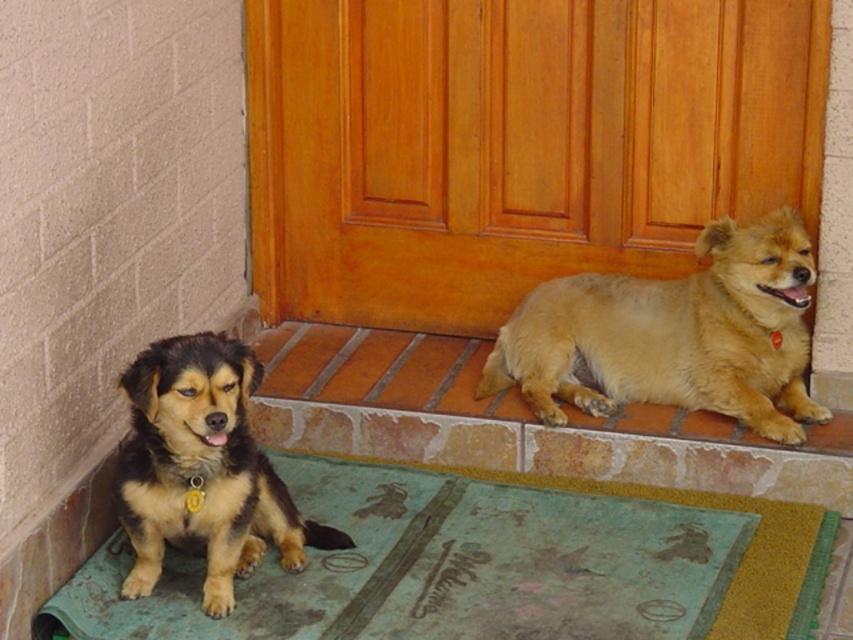
Is wooden at center smaller than green fabric doormat at lower left?

No, wooden at center is not smaller than green fabric doormat at lower left.

Describe the element at coordinates (514, 145) in the screenshot. I see `wooden at center` at that location.

This screenshot has width=853, height=640. In order to click on wooden at center in this screenshot , I will do `click(514, 145)`.

Who is more forward, (746,195) or (753,240)?

Point (753,240)

Measure the distance between point (479, 36) and camera.

Point (479, 36) and camera are 3.78 meters apart from each other.

The width and height of the screenshot is (853, 640). I want to click on wooden at center, so click(x=514, y=145).

Can you confirm if green fabric doormat at lower left is smaller than brown fur dog at left?

Actually, green fabric doormat at lower left might be larger than brown fur dog at left.

What do you see at coordinates (492, 564) in the screenshot?
I see `green fabric doormat at lower left` at bounding box center [492, 564].

What do you see at coordinates (492, 564) in the screenshot? I see `green fabric doormat at lower left` at bounding box center [492, 564].

Identify the location of green fabric doormat at lower left. This screenshot has width=853, height=640. (492, 564).